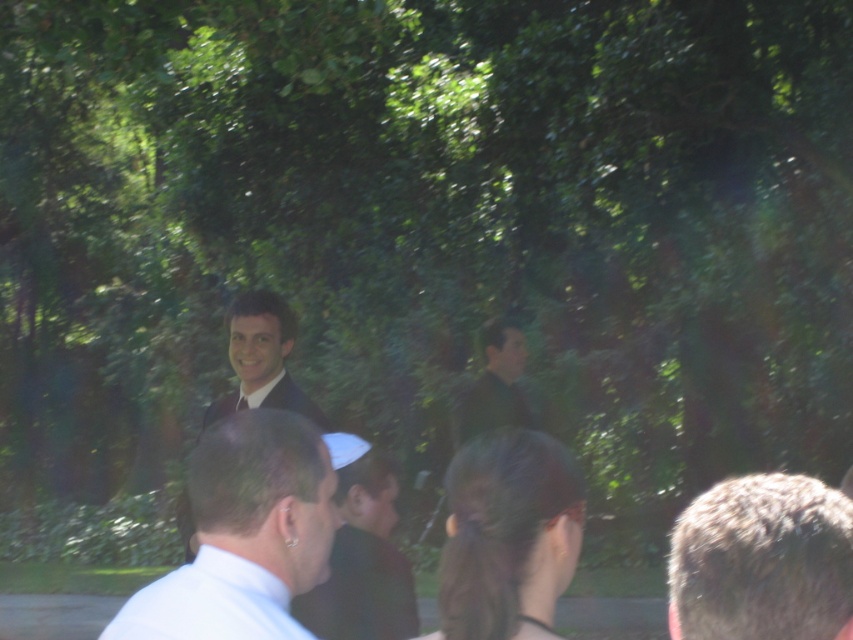
Question: Based on their relative distances, which object is farther from the blonde hair at right?

Choices:
 (A) dark green fabric shirt at center
 (B) shiny black suit at center

Answer: (B)

Question: Is white matte shirt at center to the left of dark green fabric shirt at center from the viewer's perspective?

Choices:
 (A) no
 (B) yes

Answer: (B)

Question: Observing the image, what is the correct spatial positioning of blonde hair at right in reference to shiny black suit at center?

Choices:
 (A) above
 (B) below

Answer: (B)

Question: Which of the following is the closest to the observer?

Choices:
 (A) white matte shirt at center
 (B) dark green fabric shirt at center

Answer: (A)

Question: Considering the relative positions of shiny black suit at center and dark green fabric shirt at center in the image provided, where is shiny black suit at center located with respect to dark green fabric shirt at center?

Choices:
 (A) above
 (B) below

Answer: (A)

Question: Which point appears closest to the camera in this image?

Choices:
 (A) (347, 456)
 (B) (512, 339)

Answer: (A)